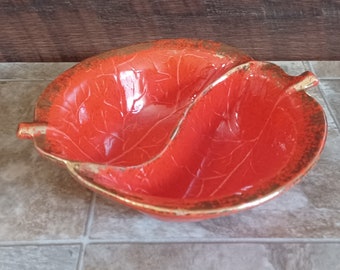
Where is `counter`? counter is located at coordinates (103, 224).